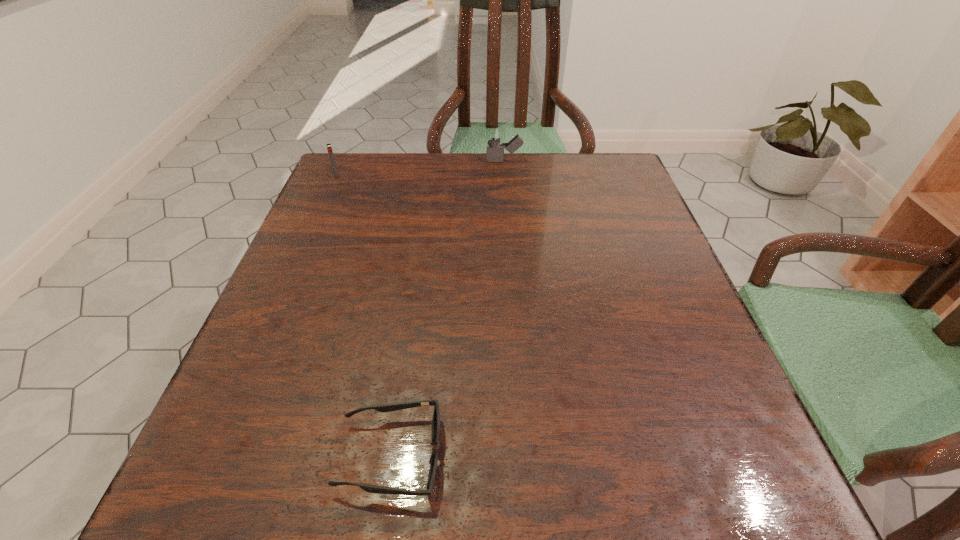
Locate an element on the screen. The width and height of the screenshot is (960, 540). object that stands as the closest to the second nearest object is located at coordinates (495, 134).

Locate an element on the screen. The width and height of the screenshot is (960, 540). the second closest object to the second farthest object is located at coordinates (433, 460).

Where is `vacant space that satisfies the following two spatial constraints: 1. on the front side of the rightmost object; 2. on the front-facing side of the nearest object`? vacant space that satisfies the following two spatial constraints: 1. on the front side of the rightmost object; 2. on the front-facing side of the nearest object is located at coordinates 527,456.